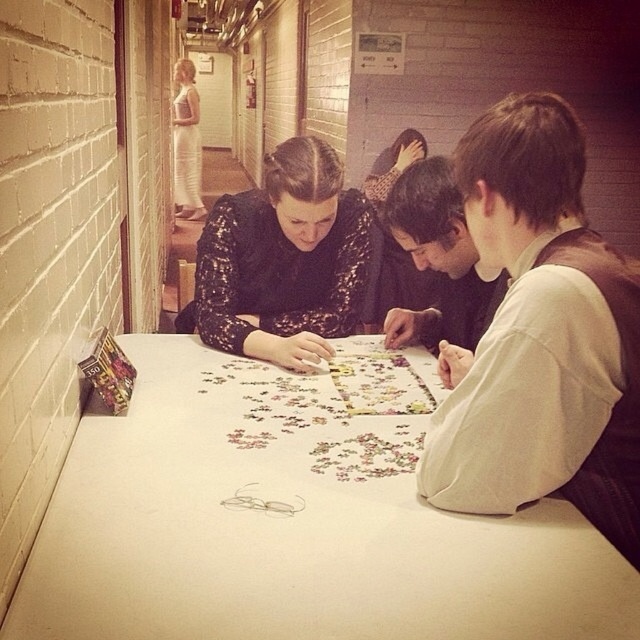
Is the position of white matte table at center less distant than that of black sequined dress at center?

That is True.

Does white matte table at center have a larger size compared to black sequined dress at center?

Indeed, white matte table at center has a larger size compared to black sequined dress at center.

Is point (563, 572) positioned before point (204, 225)?

That is True.

Locate an element on the screen. white matte table at center is located at coordinates (289, 525).

Is white cotton shirt at upper right behind white lace dress at upper left?

No, it is in front of white lace dress at upper left.

From the picture: Does white cotton shirt at upper right have a lesser width compared to white lace dress at upper left?

Correct, white cotton shirt at upper right's width is less than white lace dress at upper left's.

Between point (616, 314) and point (173, 140), which one is positioned behind?

Positioned behind is point (173, 140).

Identify the location of white cotton shirt at upper right. pos(540,337).

Is black sequined dress at center to the left of patterned fabric shirt at center from the viewer's perspective?

Indeed, black sequined dress at center is positioned on the left side of patterned fabric shirt at center.

Where is `black sequined dress at center`? black sequined dress at center is located at coordinates (284, 260).

Locate an element on the screen. black sequined dress at center is located at coordinates (284, 260).